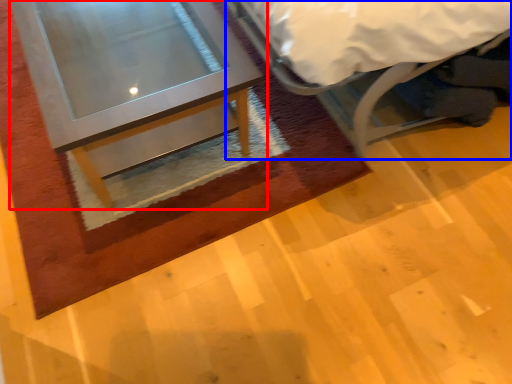
Question: Among these objects, which one is nearest to the camera, table (highlighted by a red box) or bed (highlighted by a blue box)?

Choices:
 (A) table
 (B) bed

Answer: (B)